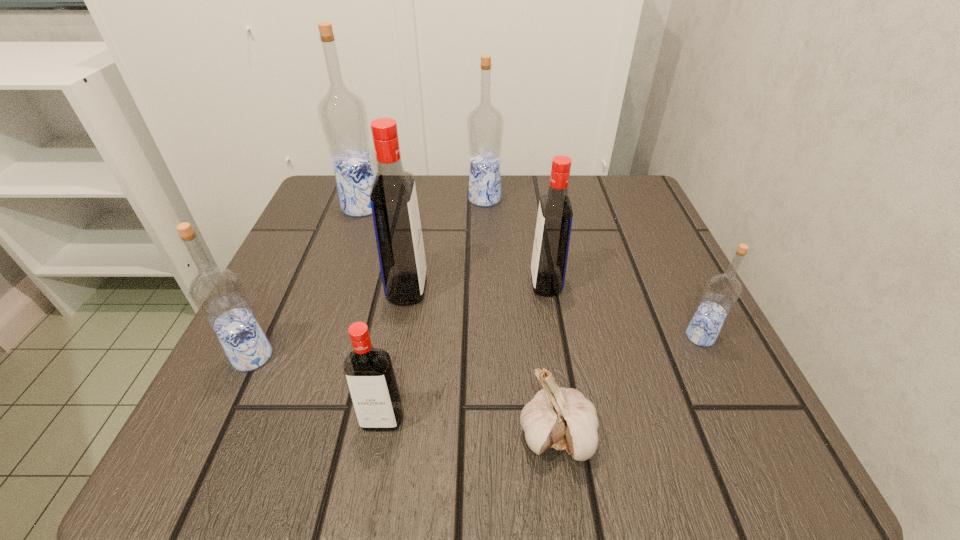
Locate an element on the screen. The width and height of the screenshot is (960, 540). free space between the tallest vodka and the smallest blue vodka is located at coordinates (531, 272).

Find the location of `free spot between the nearest red vodka and the biggest red vodka`. free spot between the nearest red vodka and the biggest red vodka is located at coordinates tap(395, 354).

The height and width of the screenshot is (540, 960). In order to click on free space between the rightmost red vodka and the leftmost object in this screenshot , I will do `click(399, 320)`.

At what (x,y) coordinates should I click in order to perform the action: click on free spot between the fifth object from left to right and the shortest object. Please return your answer as a coordinate pair (x, y). Image resolution: width=960 pixels, height=540 pixels. Looking at the image, I should click on (520, 318).

This screenshot has width=960, height=540. Identify the location of vacant point located between the garlic and the sixth vodka from left to right. [x=551, y=360].

You are a GUI agent. You are given a task and a screenshot of the screen. Output one action in this format:
    pyautogui.click(x=<x>, y=<y>)
    Task: Click on the object that is the third nearest to the tallest object
    
    Given the screenshot: What is the action you would take?
    pyautogui.click(x=218, y=293)

Choose which object is the nearest neighbor to the biggest red vodka. Please provide its 2D coordinates. Your answer should be formatted as a tuple, i.e. [(x, y)], where the tuple contains the x and y coordinates of a point satisfying the conditions above.

[(218, 293)]

The image size is (960, 540). Identify the location of the fifth closest vodka to the biggest red vodka. (x=485, y=124).

Identify which vodka is the third nearest to the third smallest blue vodka. Please provide its 2D coordinates. Your answer should be formatted as a tuple, i.e. [(x, y)], where the tuple contains the x and y coordinates of a point satisfying the conditions above.

[(393, 198)]

Locate an element on the screen. Image resolution: width=960 pixels, height=540 pixels. blue vodka that can be found as the closest to the leftmost vodka is located at coordinates (342, 114).